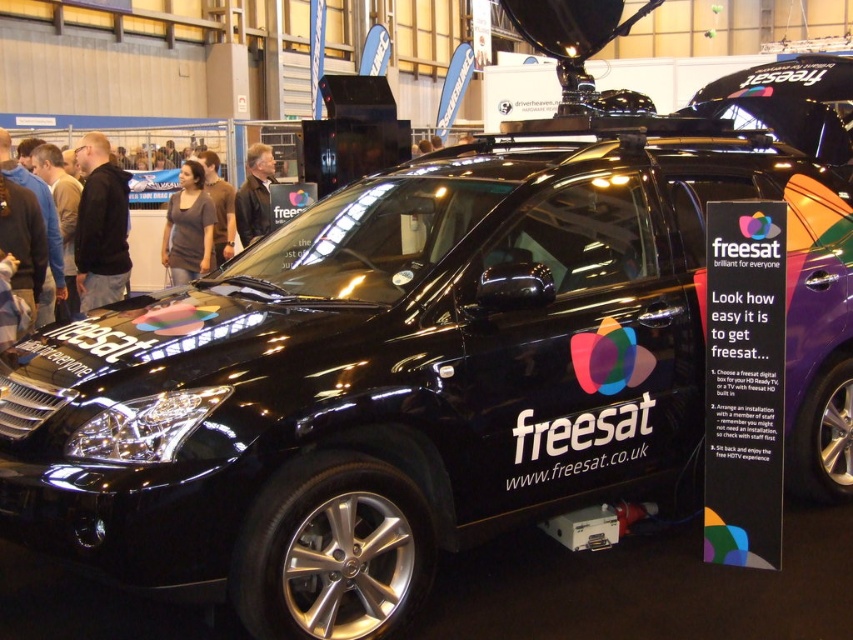
From the picture: Does black hoodie at center have a larger size compared to gray matte shirt at center?

Yes, black hoodie at center is bigger than gray matte shirt at center.

Is point (93, 164) more distant than point (161, 250)?

No.

Which is in front, point (115, 250) or point (183, 280)?

Positioned in front is point (115, 250).

Where is `black hoodie at center`? This screenshot has width=853, height=640. black hoodie at center is located at coordinates (100, 225).

From the picture: Can you confirm if gray matte shirt at center is positioned to the right of brownmaterial/textureshirt at center?

No, gray matte shirt at center is not to the right of brownmaterial/textureshirt at center.

Is point (196, 237) farther from viewer compared to point (219, 193)?

No.

You are a GUI agent. You are given a task and a screenshot of the screen. Output one action in this format:
    pyautogui.click(x=<x>, y=<y>)
    Task: Click on the gray matte shirt at center
    This screenshot has width=853, height=640.
    Given the screenshot: What is the action you would take?
    pyautogui.click(x=189, y=227)

Is gray matte shirt at center thinner than leather jacket at center?

No, gray matte shirt at center is not thinner than leather jacket at center.

Does point (186, 243) come farther from viewer compared to point (270, 218)?

That is True.

Identify the location of gray matte shirt at center. (x=189, y=227).

Locate an element on the screen. The width and height of the screenshot is (853, 640). gray matte shirt at center is located at coordinates (189, 227).